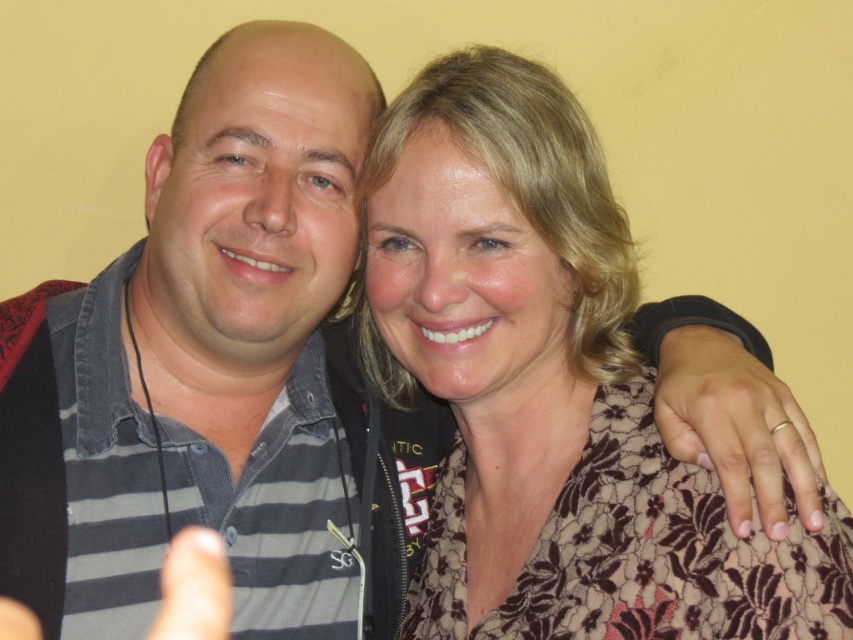
Can you confirm if gold metallic ring at right is wider than matte black thumb at lower left?

In fact, gold metallic ring at right might be narrower than matte black thumb at lower left.

Between point (711, 355) and point (221, 621), which one is positioned behind?

The point (221, 621) is behind.

I want to click on gold metallic ring at right, so click(x=737, y=428).

Locate an element on the screen. The width and height of the screenshot is (853, 640). gold metallic ring at right is located at coordinates (737, 428).

Who is shorter, floral-patterned blouse at center or matte black thumb at lower left?

With less height is matte black thumb at lower left.

Between floral-patterned blouse at center and matte black thumb at lower left, which one is positioned higher?

floral-patterned blouse at center is higher up.

Which is in front, point (608, 273) or point (196, 529)?

Point (608, 273) is in front.

The width and height of the screenshot is (853, 640). What are the coordinates of `floral-patterned blouse at center` in the screenshot? It's located at (550, 388).

Is striped fabric shirt at left above matte black thumb at lower left?

Correct, striped fabric shirt at left is located above matte black thumb at lower left.

Does striped fabric shirt at left have a lesser height compared to matte black thumb at lower left?

Incorrect, striped fabric shirt at left's height does not fall short of matte black thumb at lower left's.

You are a GUI agent. You are given a task and a screenshot of the screen. Output one action in this format:
    pyautogui.click(x=<x>, y=<y>)
    Task: Click on the striped fabric shirt at left
    Image resolution: width=853 pixels, height=640 pixels.
    Given the screenshot: What is the action you would take?
    pyautogui.click(x=219, y=349)

Locate an element on the screen. Image resolution: width=853 pixels, height=640 pixels. striped fabric shirt at left is located at coordinates (219, 349).